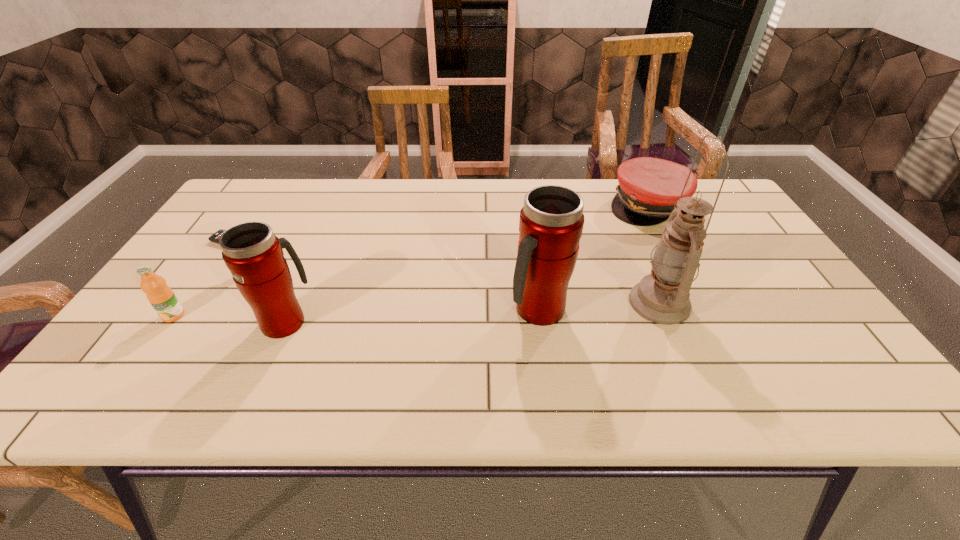
Considering the uniform spacing of thermos bottles, where should an additional thermos bottle be positioned on the right? Please locate a free spot. Please provide its 2D coordinates. Your answer should be formatted as a tuple, i.e. [(x, y)], where the tuple contains the x and y coordinates of a point satisfying the conditions above.

[(780, 301)]